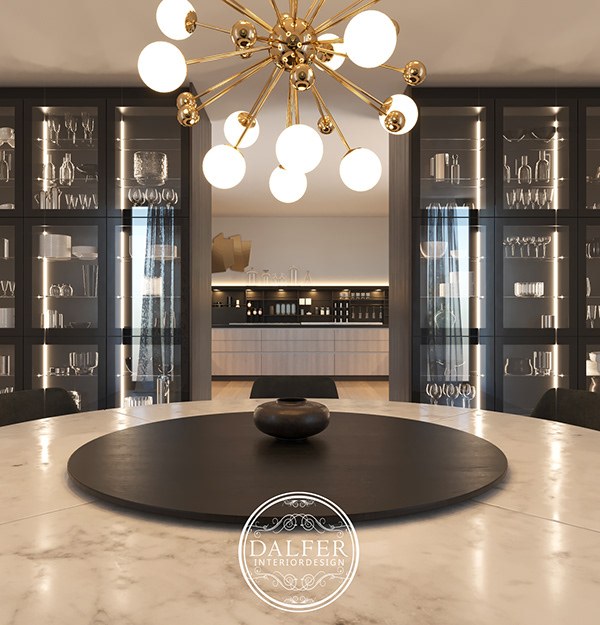
Where is `glassware`? Image resolution: width=600 pixels, height=625 pixels. glassware is located at coordinates (62, 195).